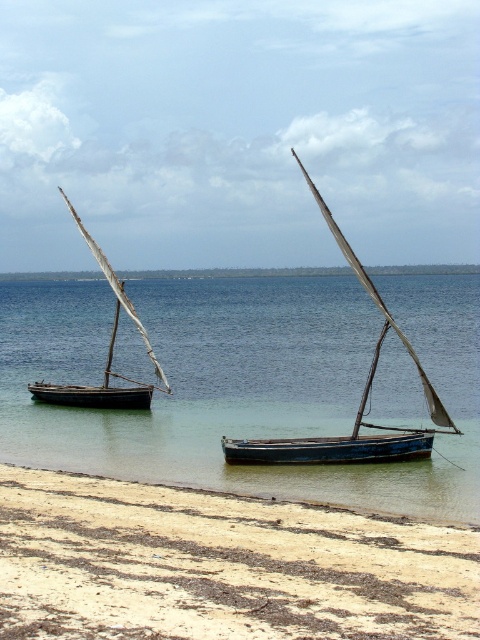
You are standing on the beach and want to take a photo of the clear blue water at center. Based on the coordinates provided, in which direction should you point your camera relative to the shoreline?

The clear blue water at center is located at coordinates approximately 60 percent along the horizontal axis and 51 percent vertically. Since the shoreline is typically at the bottom of the image, pointing the camera slightly upwards and towards the center horizontally would capture the clear blue water at center.

You are standing on the brown sandy beach at lower left and want to reach the blue wooden canoe at center. Which direction should you move in to get closer to the canoe?

You should move towards the center from the brown sandy beach at lower left to reach the blue wooden canoe at center since the canoe is located centrally in the scene.